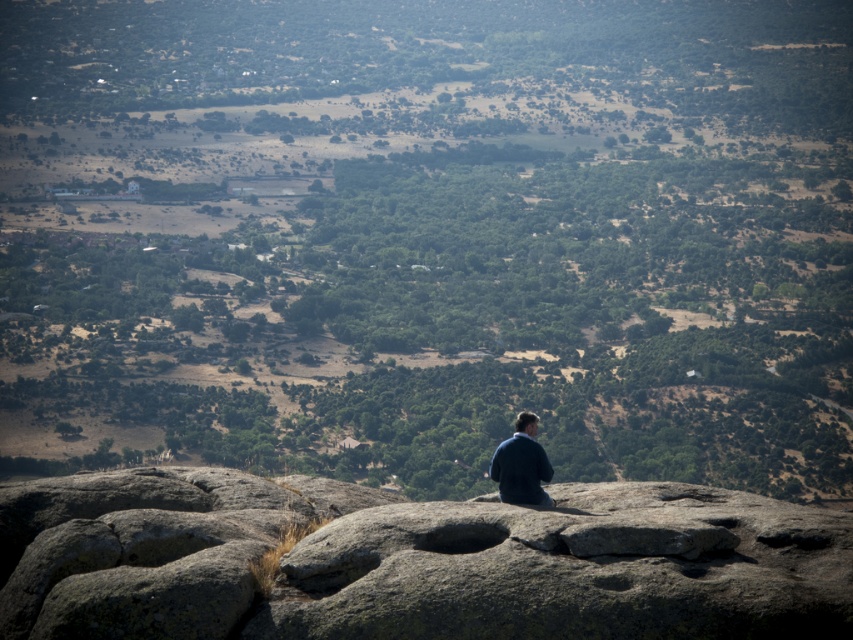
Question: Which of the following is the closest to the observer?

Choices:
 (A) (534, 433)
 (B) (248, 572)

Answer: (B)

Question: Can you confirm if gray rough rock at center is bigger than dark blue fabric at center?

Choices:
 (A) no
 (B) yes

Answer: (B)

Question: Is gray rough rock at center wider than dark blue fabric at center?

Choices:
 (A) no
 (B) yes

Answer: (B)

Question: Which of the following is the farthest from the observer?

Choices:
 (A) (341, 540)
 (B) (515, 458)

Answer: (B)

Question: Among these objects, which one is farthest from the camera?

Choices:
 (A) gray rough rock at center
 (B) dark blue fabric at center

Answer: (B)

Question: Is gray rough rock at center thinner than dark blue fabric at center?

Choices:
 (A) yes
 (B) no

Answer: (B)